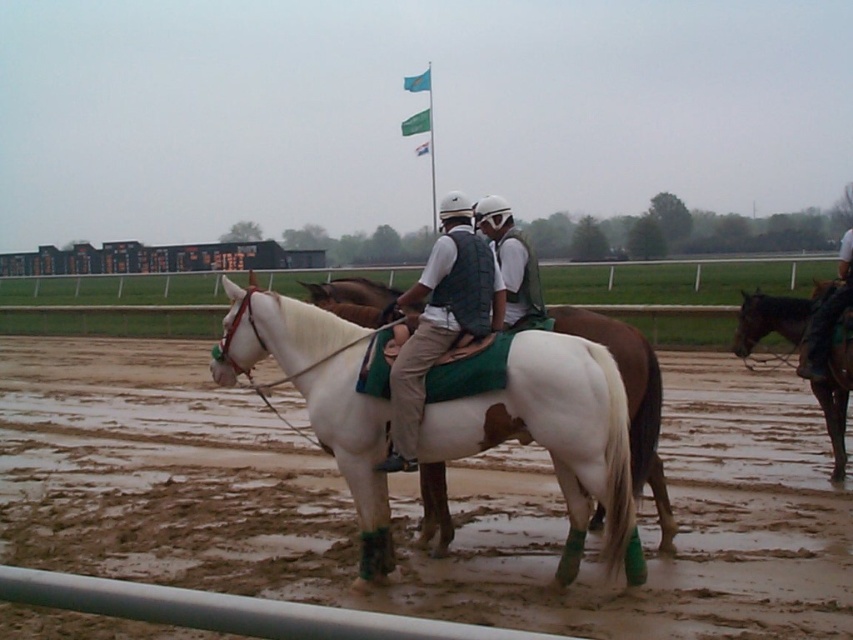
Question: Is white matte dirt field at center further to the viewer compared to green fabric flag at upper center?

Choices:
 (A) yes
 (B) no

Answer: (B)

Question: Which of the following is the farthest from the observer?

Choices:
 (A) (489, 332)
 (B) (428, 113)

Answer: (B)

Question: Considering the relative positions of white matte dirt field at center and green fabric flag at upper center in the image provided, where is white matte dirt field at center located with respect to green fabric flag at upper center?

Choices:
 (A) below
 (B) above

Answer: (A)

Question: Which of the following is the farthest from the observer?

Choices:
 (A) white glossy horse at center
 (B) white matte dirt field at center
 (C) green fabric flag at upper center

Answer: (C)

Question: Is white matte dirt field at center smaller than white glossy horse at center?

Choices:
 (A) no
 (B) yes

Answer: (A)

Question: Estimate the real-world distances between objects in this image. Which object is farther from the white matte/suede horse at center?

Choices:
 (A) brown glossy horse at right
 (B) white glossy horse at center
 (C) blue fabric flag at upper center

Answer: (C)